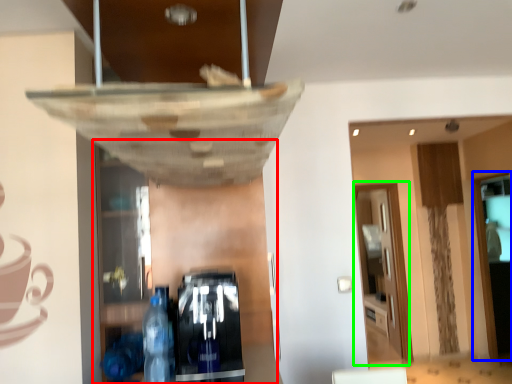
Question: Considering the real-world distances, which object is closest to shelf (highlighted by a red box)? glass door (highlighted by a blue box) or glass door (highlighted by a green box).

Choices:
 (A) glass door
 (B) glass door

Answer: (A)